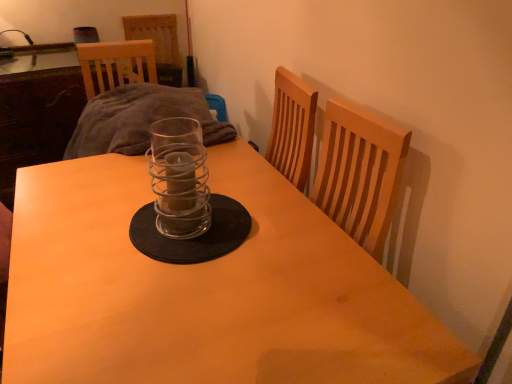
You are a GUI agent. You are given a task and a screenshot of the screen. Output one action in this format:
    pyautogui.click(x=<x>, y=<y>)
    Task: Click on the free space in front of clear glass candle holder at center
    This screenshot has width=512, height=384.
    Given the screenshot: What is the action you would take?
    pyautogui.click(x=173, y=276)